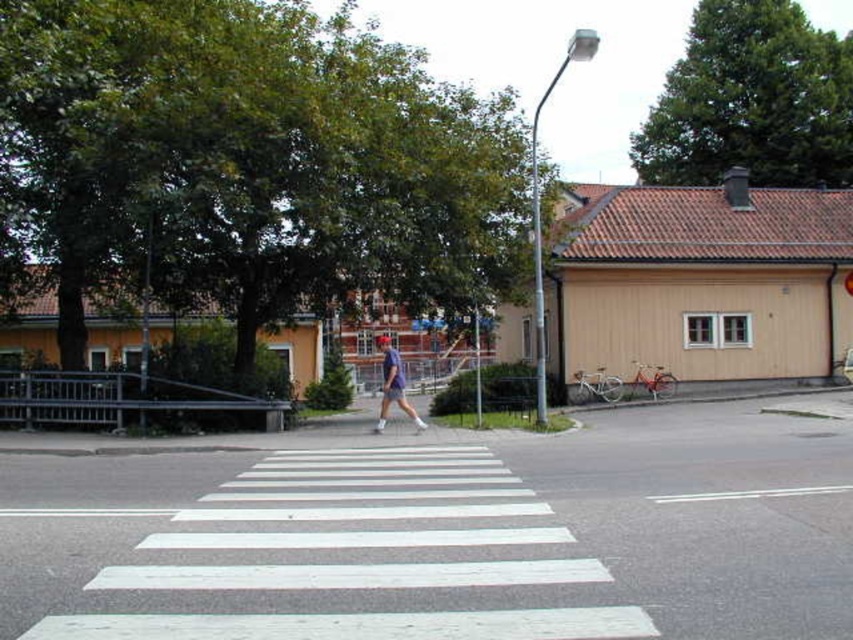
Question: Which point is farther to the camera?

Choices:
 (A) blue fabric shorts at center
 (B) white painted crosswalk at center

Answer: (A)

Question: Does white painted crosswalk at center have a larger size compared to blue fabric shorts at center?

Choices:
 (A) no
 (B) yes

Answer: (A)

Question: Can you confirm if white painted crosswalk at center is positioned to the left of blue fabric shorts at center?

Choices:
 (A) yes
 (B) no

Answer: (A)

Question: Is white painted crosswalk at center further to the viewer compared to blue fabric shorts at center?

Choices:
 (A) yes
 (B) no

Answer: (B)